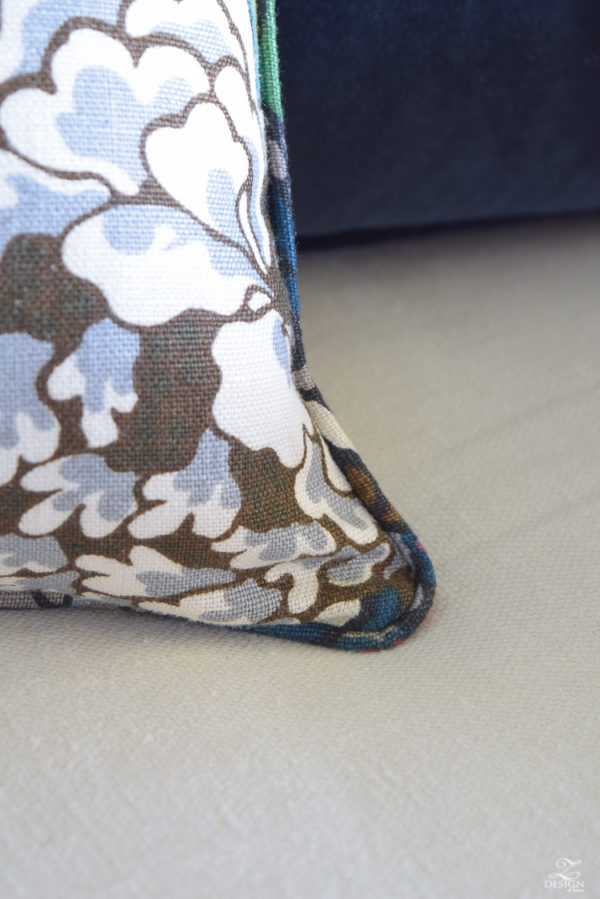
Find the location of a particular element. white couch surface is located at coordinates (498, 451).